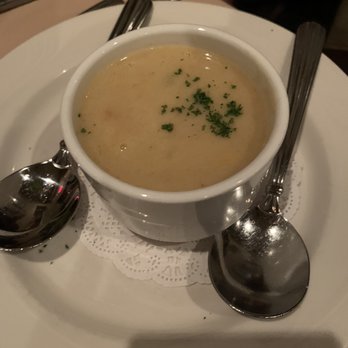
Identify the location of plate. (85, 300).